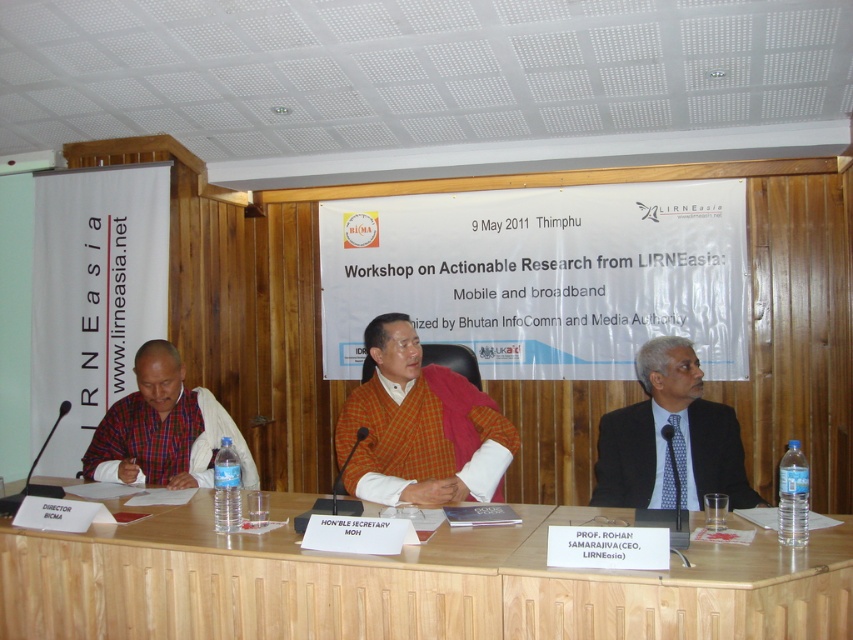
Does white paper at center appear under dark blue suit at right?

No, white paper at center is not below dark blue suit at right.

Is point (735, 202) behind point (735, 468)?

Yes, it is.

At what (x,y) coordinates should I click in order to perform the action: click on white paper at center. Please return your answer as a coordinate pair (x, y). Looking at the image, I should click on (543, 275).

Is light brown wood table at center below white paper at center?

Indeed, light brown wood table at center is positioned under white paper at center.

In the scene shown: Who is more distant from viewer, (387, 593) or (645, 323)?

The point (645, 323) is behind.

The width and height of the screenshot is (853, 640). In order to click on light brown wood table at center in this screenshot , I will do `click(407, 582)`.

At what (x,y) coordinates should I click in order to perform the action: click on orange woolen sweater at center. Please return your answer as a coordinate pair (x, y). The height and width of the screenshot is (640, 853). Looking at the image, I should click on (419, 426).

Is orange woolen sweater at center above matte plaid shirt at left?

Yes.

Is point (349, 440) more distant than point (126, 417)?

No, (349, 440) is closer to viewer.

Where is `orange woolen sweater at center`? This screenshot has width=853, height=640. orange woolen sweater at center is located at coordinates (419, 426).